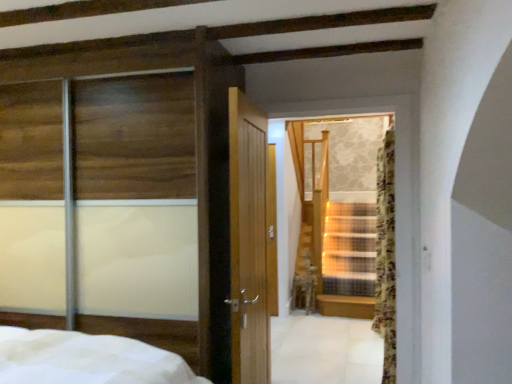
Question: Is floral fabric curtain at right to the right of transparent glass sliding door at left from the viewer's perspective?

Choices:
 (A) yes
 (B) no

Answer: (A)

Question: Can you confirm if floral fabric curtain at right is thinner than transparent glass sliding door at left?

Choices:
 (A) yes
 (B) no

Answer: (A)

Question: Is floral fabric curtain at right closer to camera compared to transparent glass sliding door at left?

Choices:
 (A) yes
 (B) no

Answer: (B)

Question: From a real-world perspective, is floral fabric curtain at right located beneath transparent glass sliding door at left?

Choices:
 (A) yes
 (B) no

Answer: (A)

Question: Can you confirm if floral fabric curtain at right is positioned to the left of transparent glass sliding door at left?

Choices:
 (A) no
 (B) yes

Answer: (A)

Question: Is floral fabric curtain at right inside the boundaries of transparent glass stairs at center, or outside?

Choices:
 (A) outside
 (B) inside

Answer: (A)

Question: Looking at their shapes, would you say floral fabric curtain at right is wider or thinner than transparent glass stairs at center?

Choices:
 (A) thin
 (B) wide

Answer: (B)

Question: Considering the positions of point (392, 281) and point (253, 339), is point (392, 281) closer or farther from the camera than point (253, 339)?

Choices:
 (A) farther
 (B) closer

Answer: (A)

Question: From a real-world perspective, is floral fabric curtain at right positioned above or below transparent glass stairs at center?

Choices:
 (A) above
 (B) below

Answer: (B)

Question: Is transparent glass sliding door at left bigger or smaller than transparent glass stairs at center?

Choices:
 (A) small
 (B) big

Answer: (B)

Question: Looking at their shapes, would you say transparent glass sliding door at left is wider or thinner than transparent glass stairs at center?

Choices:
 (A) thin
 (B) wide

Answer: (B)

Question: Considering the positions of point (157, 137) and point (266, 319), is point (157, 137) closer or farther from the camera than point (266, 319)?

Choices:
 (A) closer
 (B) farther

Answer: (A)

Question: Visually, is transparent glass sliding door at left positioned to the left or to the right of transparent glass stairs at center?

Choices:
 (A) left
 (B) right

Answer: (A)

Question: Relative to floral fabric curtain at right, is transparent glass stairs at center in front or behind?

Choices:
 (A) front
 (B) behind

Answer: (A)

Question: From the image's perspective, is transparent glass stairs at center positioned above or below floral fabric curtain at right?

Choices:
 (A) below
 (B) above

Answer: (B)